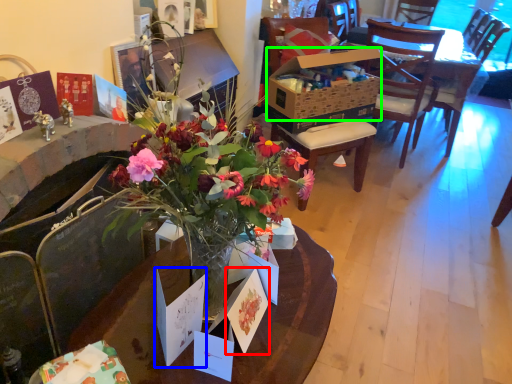
Question: Estimate the real-world distances between objects in this image. Which object is closer to postcard (highlighted by a red box), postcard (highlighted by a blue box) or box (highlighted by a green box)?

Choices:
 (A) postcard
 (B) box

Answer: (A)